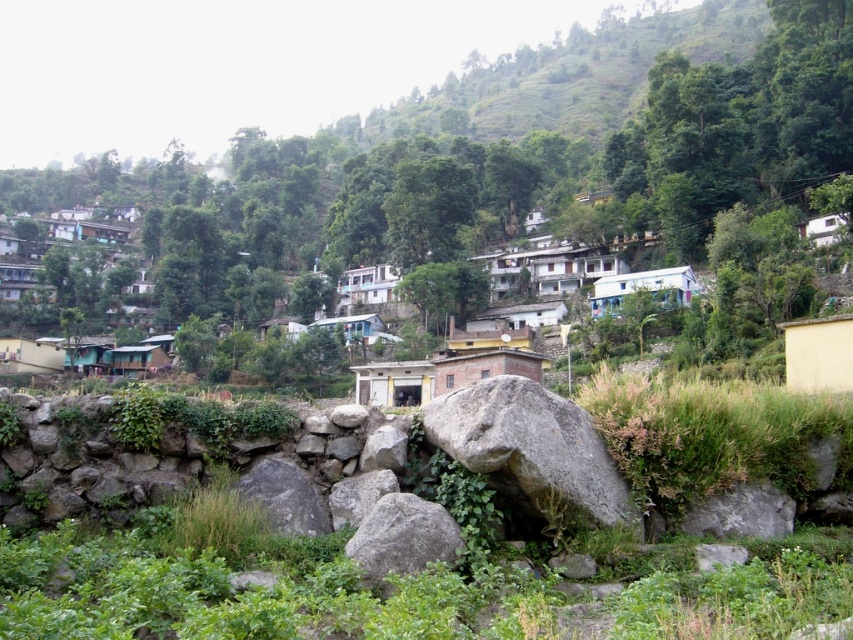
You are a visitor standing in front of the yellow matte wall at right and the white painted wood hut at center. Which object is positioned lower in the scene?

The yellow matte wall at right is located below the white painted wood hut at center, so the yellow matte wall at right is positioned lower in the scene.

You are a painter who wants to paint the yellow matte wall at right and the white painted wood hut at center. Which object requires more paint considering their widths?

The white painted wood hut at center requires more paint because it is wider than the yellow matte wall at right.

You are standing in the middle of the hillside settlement and want to visit both the white painted wood house at center and the green matte hut at center. Which one should you go to first if you want to start with the one that is to the left?

The green matte hut at center is to the left of the white painted wood house at center, so you should visit the green matte hut at center first.